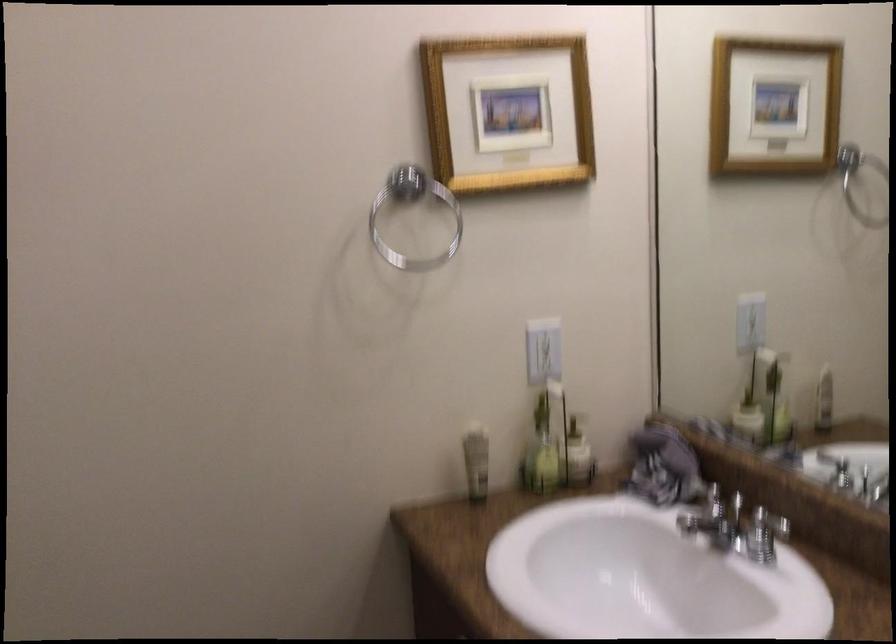
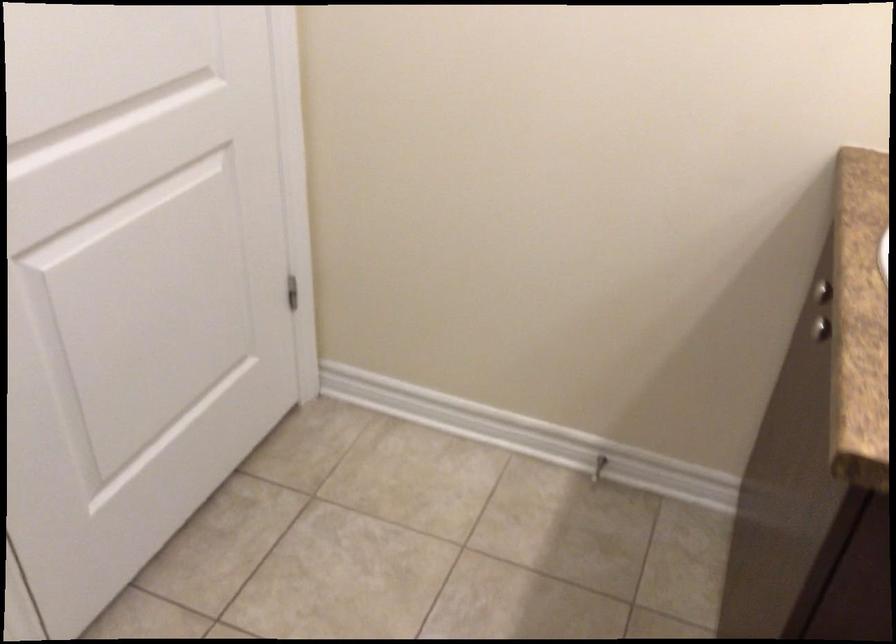
Based on the photo, based on the continuous images, in which direction is the camera rotating?

The rotation direction of the camera is left-down.